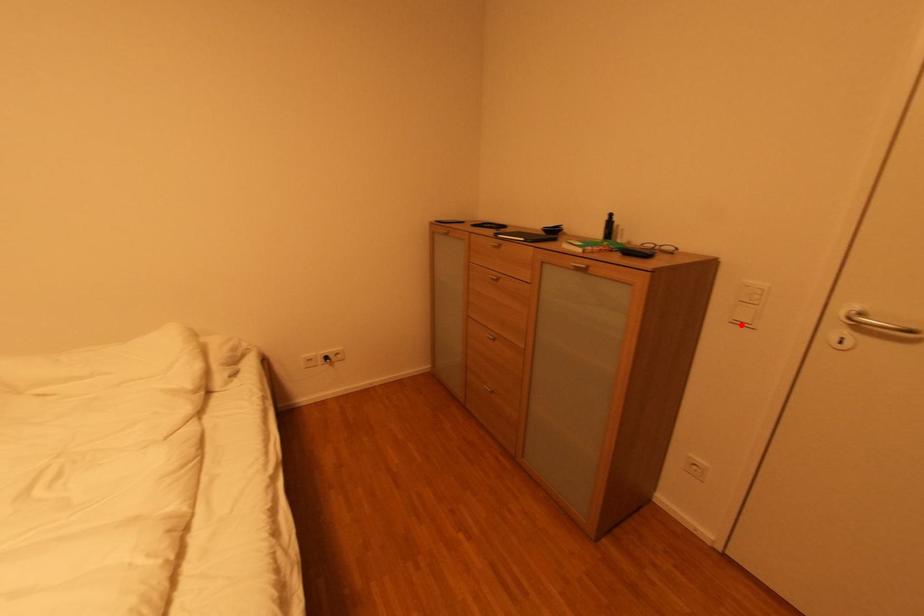
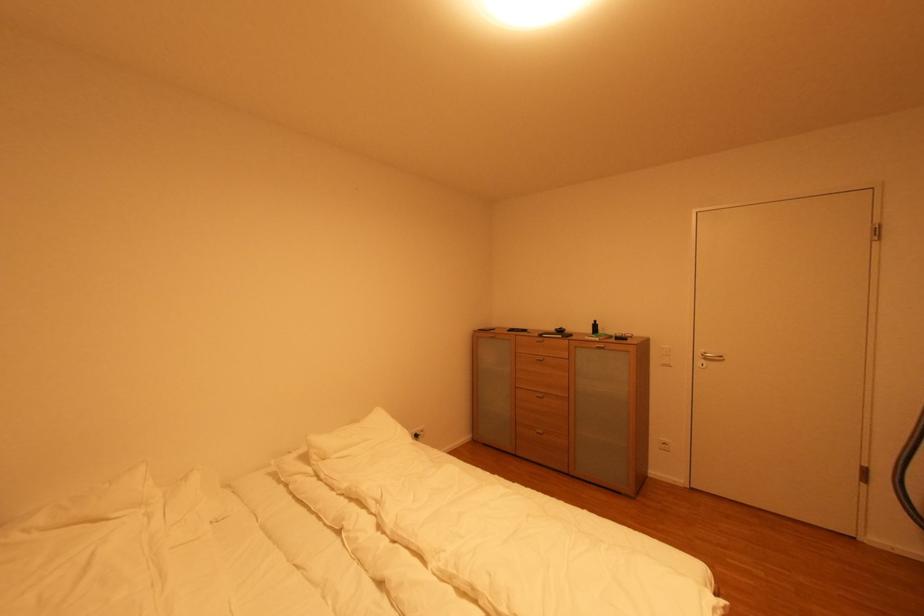
Question: I am providing you with two images of the same scene from different viewpoints. Image1 has a red point marked. In image2, the corresponding 3D location appears at what relative position? Reply with the corresponding letter.

Choices:
 (A) Closer
 (B) Farther

Answer: (B)